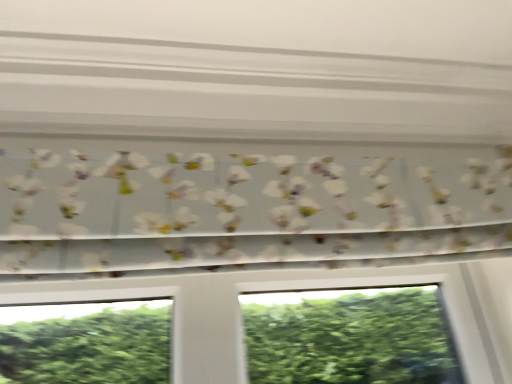
Measure the distance between point [290,253] and camera.

Point [290,253] is 32.99 inches away from camera.

Image resolution: width=512 pixels, height=384 pixels. What do you see at coordinates (241, 209) in the screenshot?
I see `floral-patterned fabric at center` at bounding box center [241, 209].

Identify the location of floral-patterned fabric at center. The image size is (512, 384). (241, 209).

Identify the location of floral-patterned fabric at center. The width and height of the screenshot is (512, 384). (241, 209).